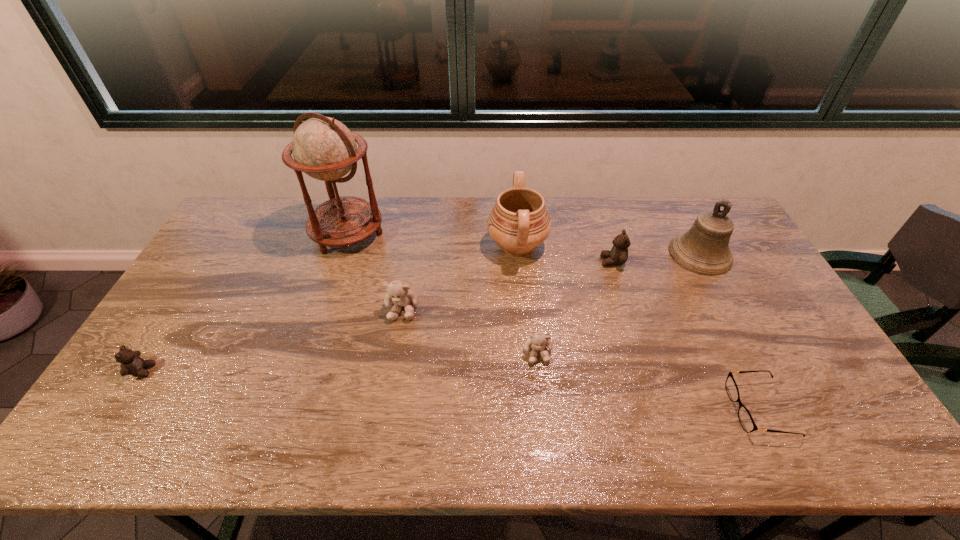
Where is `object at the near edge`? object at the near edge is located at coordinates (745, 418).

Locate an element on the screen. object that is at the left edge is located at coordinates (131, 363).

At what (x,y) coordinates should I click in order to perform the action: click on object that is at the right edge. Please return your answer as a coordinate pair (x, y). Looking at the image, I should click on [704, 249].

This screenshot has width=960, height=540. What are the coordinates of `object that is at the far right corner` in the screenshot? It's located at (704, 249).

In the image, there is a desktop. Where is `vacant space at the far edge`? vacant space at the far edge is located at coordinates (633, 233).

Identify the location of vacant space at the near edge of the desktop. (196, 454).

You are a GUI agent. You are given a task and a screenshot of the screen. Output one action in this format:
    pyautogui.click(x=<x>, y=<y>)
    Task: Click on the vacant area at the left edge
    This screenshot has width=960, height=540.
    Given the screenshot: What is the action you would take?
    pyautogui.click(x=125, y=404)

Where is `vacant space at the right edge`? The height and width of the screenshot is (540, 960). vacant space at the right edge is located at coordinates (797, 369).

Find the location of `empty space that is in between the farthest teddy bear and the second object from left to right`. empty space that is in between the farthest teddy bear and the second object from left to right is located at coordinates (480, 248).

Identify the location of vacant area between the bell and the second teddy bear from right to left. Image resolution: width=960 pixels, height=540 pixels. (619, 303).